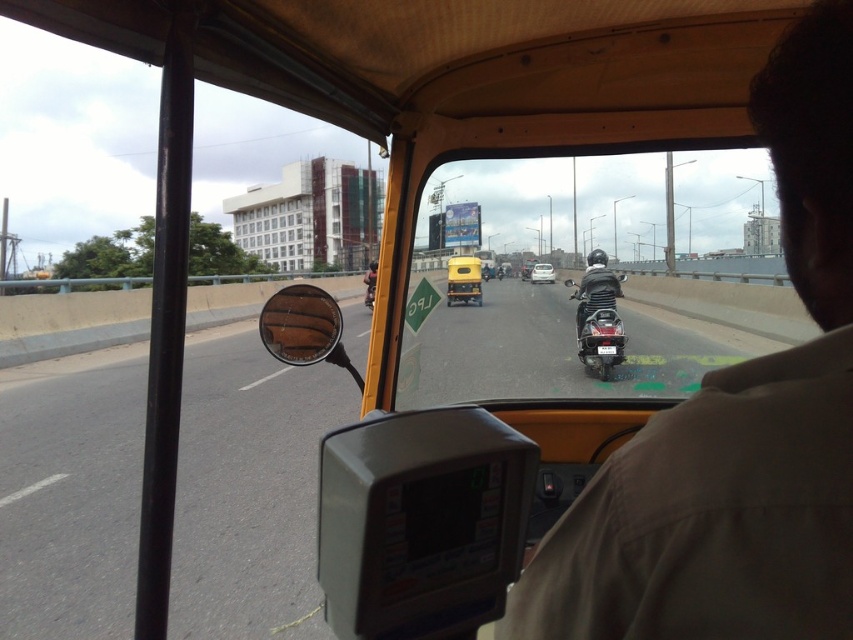
You are a passenger in the vehicle and want to know which object in front is bigger between the yellow matte bus at center and the metallic silver car at center. Which one is bigger?

The yellow matte bus at center is larger in size compared to the metallic silver car at center.

You are a passenger in the vehicle and want to know which vehicle is closer to you between the yellow matte bus at center and the metallic silver car at center. Based on your observation from inside the vehicle, which one is nearer?

The yellow matte bus at center is closer to you because it is positioned in front of the metallic silver car at center.

You are a passenger in the vehicle and looking through the windshield. You see a matte black motorcycle at center and a metallic silver car at center. Which one is closer to the vehicle you are in?

The matte black motorcycle at center is closer because it is in front of the metallic silver car at center.